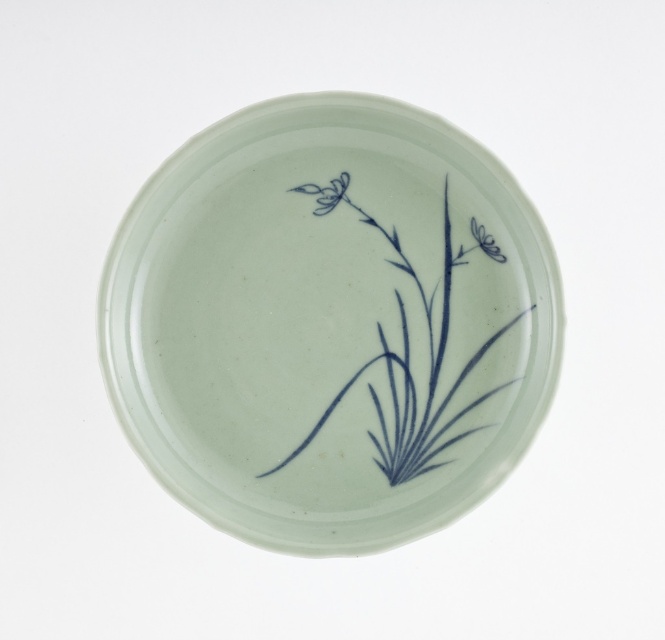
You are a chef preparing to place a garnish on the plate. The garnish requires precise placement between the lustre porcelain plate at center and the blue ink plant at center. What is the minimum distance you need to maintain between them to ensure the garnish fits?

The minimum distance you need to maintain between the lustre porcelain plate at center and the blue ink plant at center is 1.70 centimeters, as they are already 1.70 centimeters apart.

You are an art restorer examining the ceramic dish. You need to determine the order of the blue ink plant at center and the blue porcelain flower at center to ensure proper restoration. Which one is placed above the other?

The blue ink plant at center is positioned under blue porcelain flower at center, so the blue porcelain flower at center is above the blue ink plant at center.

You are an art conservator examining a porcelain dish. You notice two blue designs on it. One is a blue ink plant at center and the other is a blue glossy flower at upper left. Based on their positions, which one is positioned lower on the dish?

The blue ink plant at center is located below the blue glossy flower at upper left, so it is positioned lower on the dish.